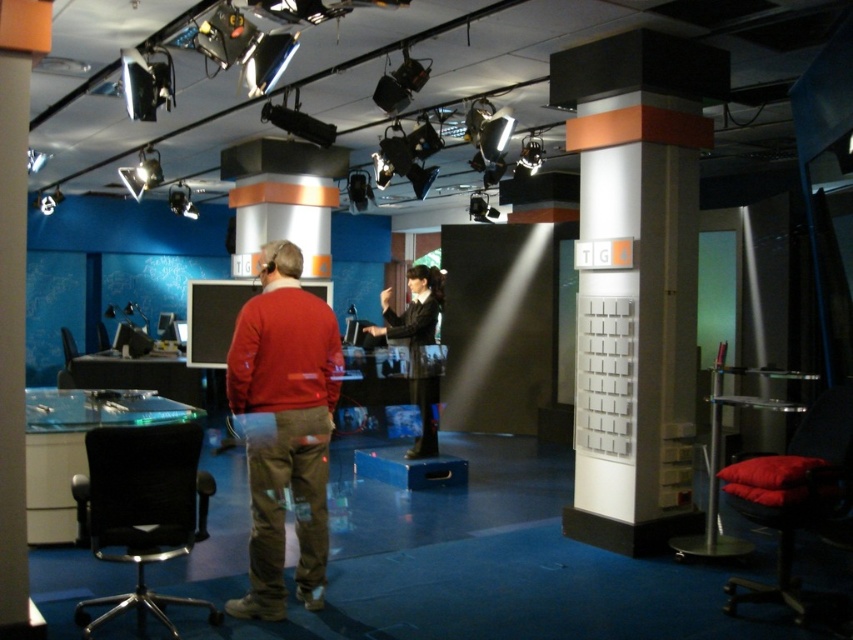
You are a camera operator in the studio. You need to focus on the matte red sweater at center without the white plastic pillar at center blocking the view. Is this possible given their positions?

The white plastic pillar at center is above the matte red sweater at center, so if you position the camera below the pillar, you can focus on the matte red sweater at center without the pillar blocking the view.

You are a camera operator in the studio and need to adjust your position to focus on both the white plastic pillar at center and the matte red sweater at center. Which object should you move your camera to the left to capture better?

The white plastic pillar at center is to the right of the matte red sweater at center. To capture both objects, you should move your camera to the left to include the white plastic pillar at center which is positioned further right.

You are a guest speaker who needs to sit down quickly during a live broadcast. There are two options available in the studio. Can you identify which seating option is wider between the black mesh swivel chair at lower left and the black glossy suit at center?

The black mesh swivel chair at lower left is wider than the black glossy suit at center, so you should choose the black mesh swivel chair at lower left.